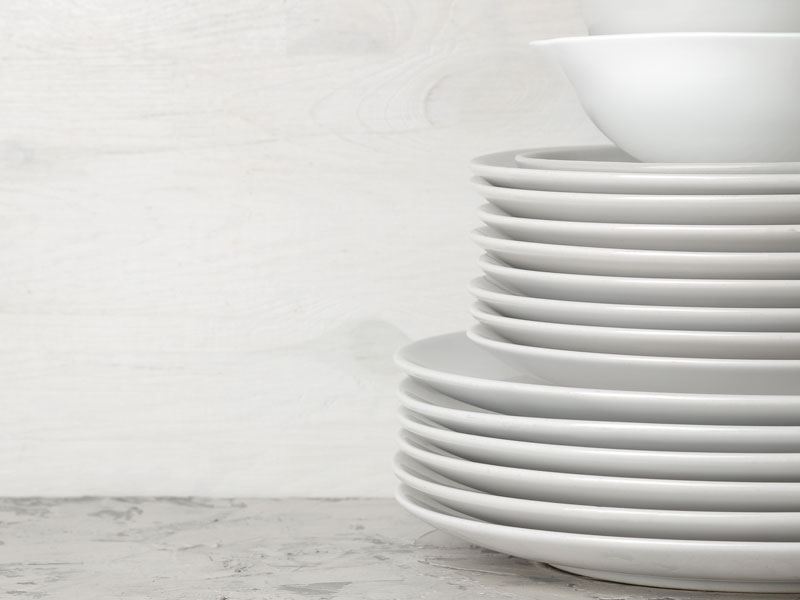
Image resolution: width=800 pixels, height=600 pixels. Identify the location of small plates. (590, 361), (584, 337), (576, 314), (572, 289), (568, 261), (564, 227), (560, 210), (554, 182).